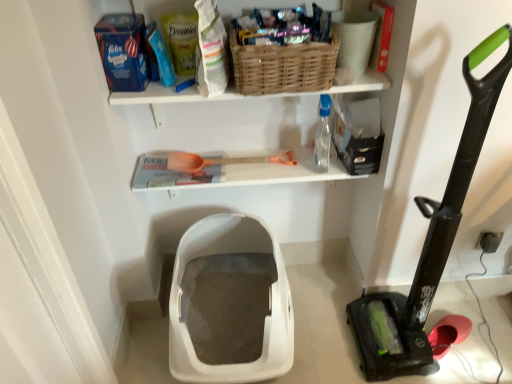
Find the location of a particular element. vacant region below white plastic litter box at center, which is the second storage box in right-to-left order (from a real-world perspective) is located at coordinates (231, 320).